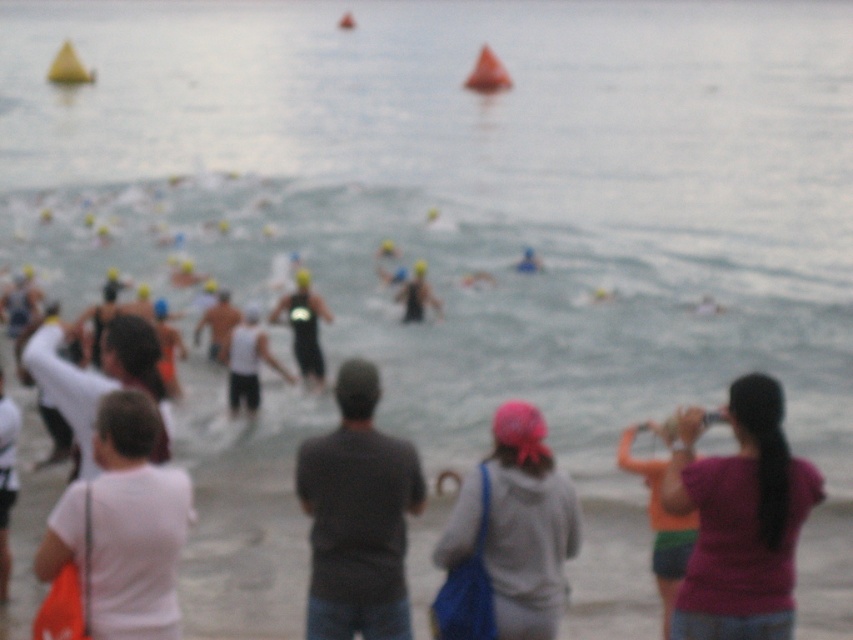
Which is more to the right, gray fabric hoodie at center or white matte shirt at lower left?

Positioned to the right is gray fabric hoodie at center.

Does gray fabric hoodie at center lie behind white matte shirt at lower left?

That is True.

Between point (534, 474) and point (106, 529), which one is positioned in front?

Point (106, 529) is in front.

In order to click on gray fabric hoodie at center in this screenshot , I will do `click(508, 538)`.

Is dark gray shirt at center closer to the viewer compared to black matte wetsuit at center?

Yes, it is.

Does dark gray shirt at center appear over black matte wetsuit at center?

No, dark gray shirt at center is not above black matte wetsuit at center.

Identify the location of dark gray shirt at center. This screenshot has width=853, height=640. (357, 516).

Image resolution: width=853 pixels, height=640 pixels. Identify the location of dark gray shirt at center. (357, 516).

Which is behind, point (160, 508) or point (321, 358)?

The point (321, 358) is behind.

Is white matte shirt at lower left further to camera compared to black matte wetsuit at center?

No, white matte shirt at lower left is closer to the viewer.

Is point (109, 424) behind point (314, 337)?

No, it is not.

Find the location of a particular element. This screenshot has width=853, height=640. white matte shirt at lower left is located at coordinates point(123,524).